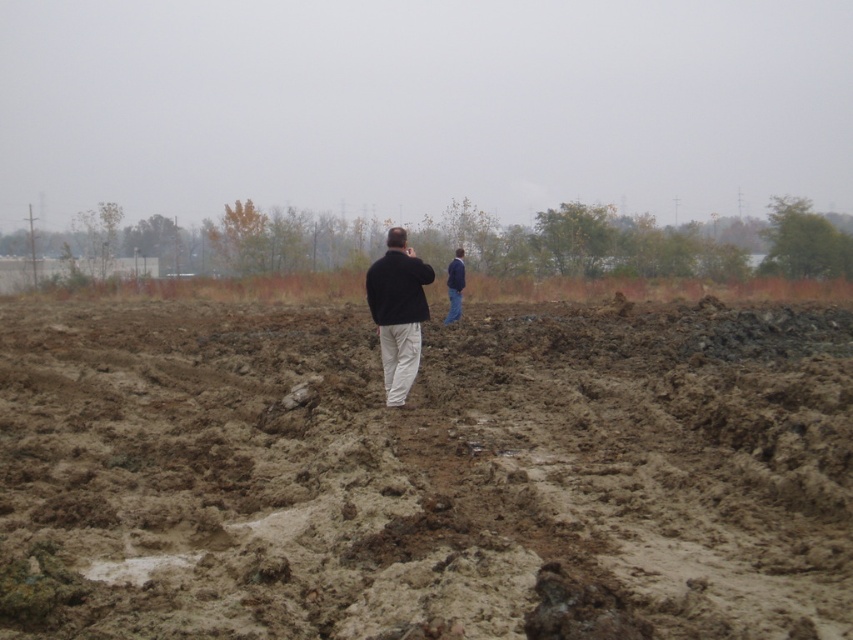
Is matte black jacket at center below blue denim jacket at center?

Correct, matte black jacket at center is located below blue denim jacket at center.

Is matte black jacket at center thinner than blue denim jacket at center?

No, matte black jacket at center is not thinner than blue denim jacket at center.

Does point (416, 275) lie in front of point (448, 321)?

Yes.

This screenshot has height=640, width=853. Find the location of `matte black jacket at center`. matte black jacket at center is located at coordinates (398, 312).

Is brown muddy field at center closer to the viewer compared to blue denim jacket at center?

Yes, it is.

Is brown muddy field at center thinner than blue denim jacket at center?

No.

The height and width of the screenshot is (640, 853). What do you see at coordinates (425, 474) in the screenshot?
I see `brown muddy field at center` at bounding box center [425, 474].

Identify the location of brown muddy field at center. (425, 474).

Who is positioned more to the left, brown muddy field at center or matte black jacket at center?

From the viewer's perspective, brown muddy field at center appears more on the left side.

Is brown muddy field at center bigger than matte black jacket at center?

Yes.

The width and height of the screenshot is (853, 640). I want to click on brown muddy field at center, so click(x=425, y=474).